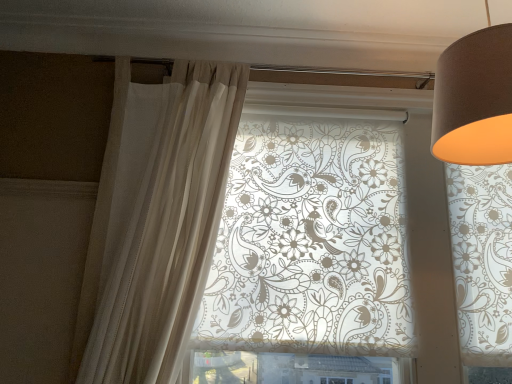
Question: Choose the correct answer: Is translucent floral-patterned roller blind at center inside matte brown lampshade at upper right or outside it?

Choices:
 (A) inside
 (B) outside

Answer: (B)

Question: From their relative heights in the image, would you say translucent floral-patterned roller blind at center is taller or shorter than matte brown lampshade at upper right?

Choices:
 (A) short
 (B) tall

Answer: (B)

Question: Which is nearer to the sheer white curtain at left?

Choices:
 (A) translucent floral-patterned roller blind at center
 (B) matte brown lampshade at upper right

Answer: (A)

Question: Estimate the real-world distances between objects in this image. Which object is closer to the translucent floral-patterned roller blind at center?

Choices:
 (A) sheer white curtain at left
 (B) matte brown lampshade at upper right

Answer: (A)